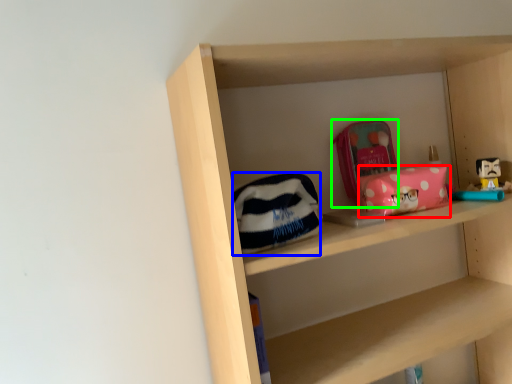
Question: Considering the real-world distances, which object is closest to package (highlighted by a red box)? pouch (highlighted by a blue box) or pouch (highlighted by a green box).

Choices:
 (A) pouch
 (B) pouch

Answer: (B)